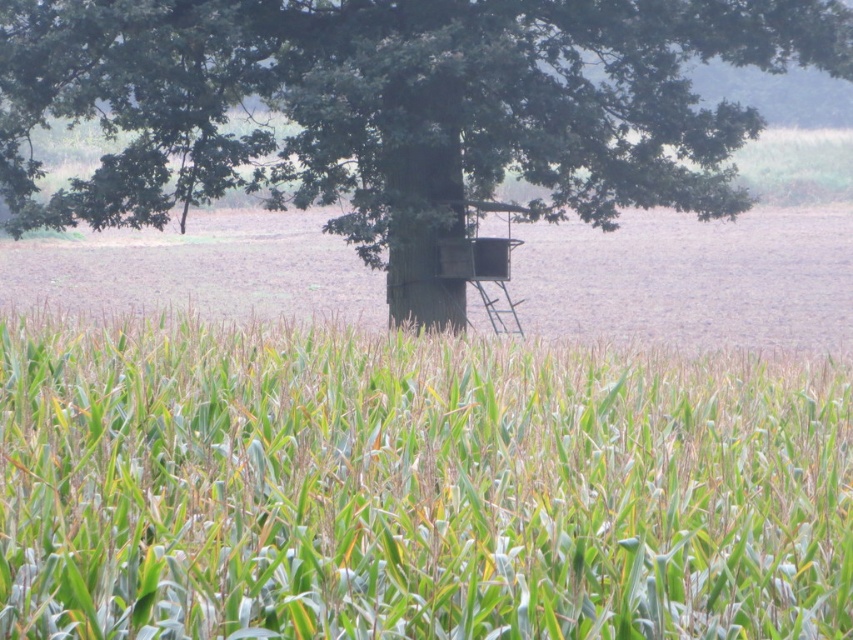
Question: Can you confirm if green matte corn field at center is smaller than green wood tree at center?

Choices:
 (A) yes
 (B) no

Answer: (A)

Question: Which object is farther from the camera taking this photo?

Choices:
 (A) green matte corn field at center
 (B) green wood tree at center

Answer: (B)

Question: Does green matte corn field at center have a smaller size compared to green wood tree at center?

Choices:
 (A) no
 (B) yes

Answer: (B)

Question: Is the position of green matte corn field at center less distant than that of green wood tree at center?

Choices:
 (A) no
 (B) yes

Answer: (B)